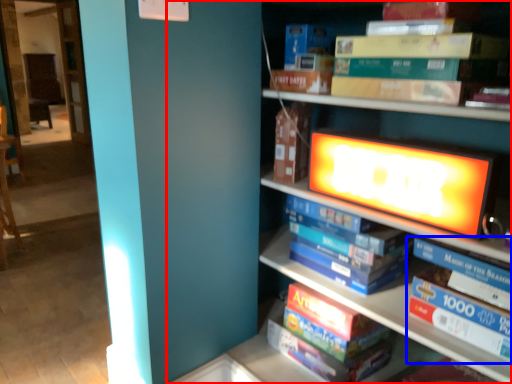
Question: Which of the following is the closest to the observer, bookcase (highlighted by a red box) or book (highlighted by a blue box)?

Choices:
 (A) bookcase
 (B) book

Answer: (A)